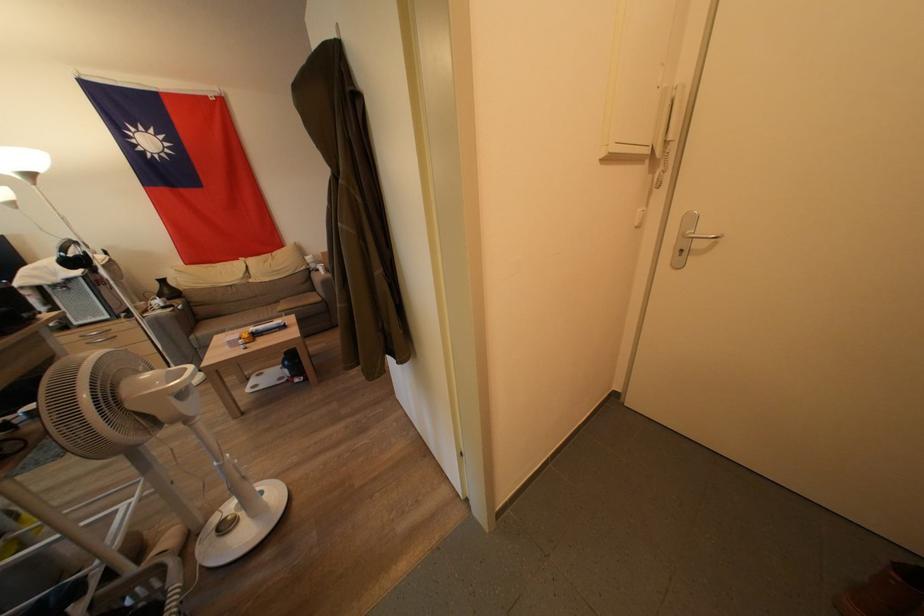
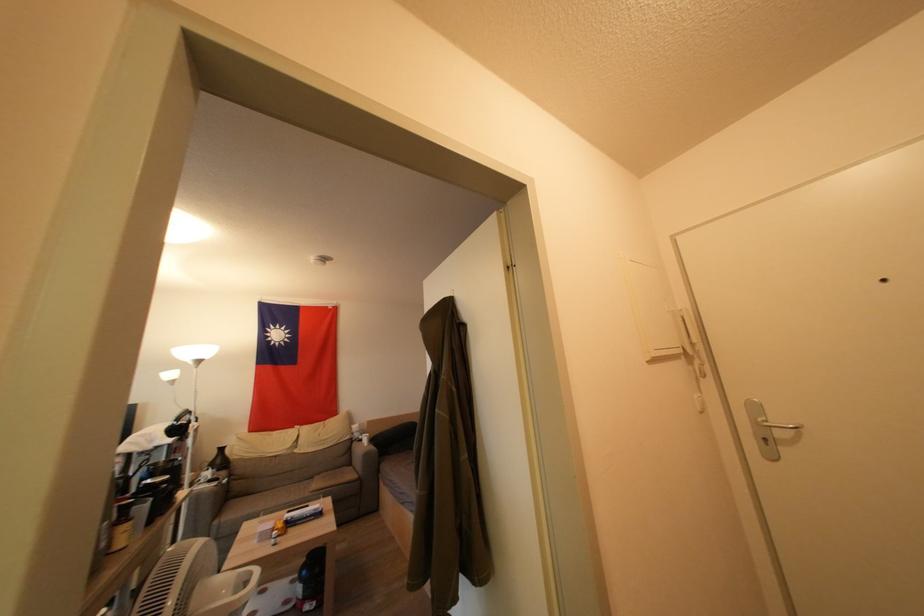
Locate, in the second image, the point that corresponds to (190,373) in the first image.

(256, 577)